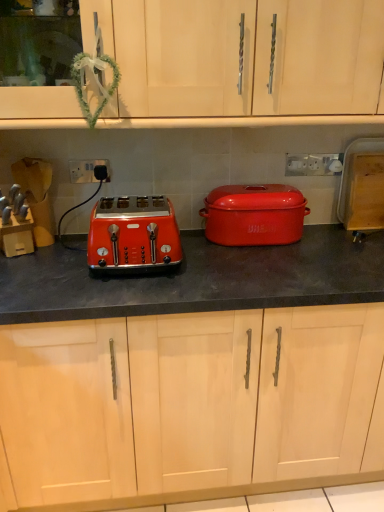
Question: From the image's perspective, is matte orange toaster at left located above or below matte black toaster at left, which appears as the 2th cabinetry when viewed from the top?

Choices:
 (A) below
 (B) above

Answer: (B)

Question: In the image, is matte orange toaster at left positioned in front of or behind matte black toaster at left, arranged as the first cabinetry when ordered from the bottom?

Choices:
 (A) behind
 (B) front

Answer: (A)

Question: Which object is positioned closest to the matte orange toaster at left?

Choices:
 (A) white plastic socket at center, which is the first electric outlet in left-to-right order
 (B) matte black toaster at left, arranged as the first cabinetry when ordered from the bottom
 (C) white plastic electric outlet at upper center, which is counted as the 2th electric outlet, starting from the left
 (D) matte red casserole at center
 (E) matte wood cabinet at upper center, the second cabinetry positioned from the bottom

Answer: (D)

Question: Which object is positioned farthest from the matte red casserole at center?

Choices:
 (A) white plastic electric outlet at upper center, the second electric outlet viewed from the front
 (B) white plastic socket at center, which appears as the second electric outlet when viewed from the right
 (C) matte wood cabinet at upper center, the second cabinetry positioned from the bottom
 (D) matte black toaster at left, which appears as the 2th cabinetry when viewed from the top
 (E) matte orange toaster at left

Answer: (B)